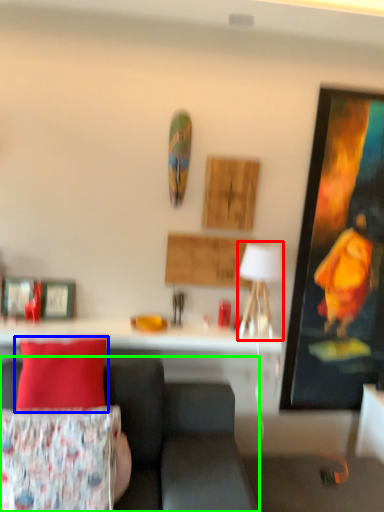
Question: Which object is positioned closest to table lamp (highlighted by a red box)? Select from pillow (highlighted by a blue box) and studio couch (highlighted by a green box).

Choices:
 (A) pillow
 (B) studio couch

Answer: (B)